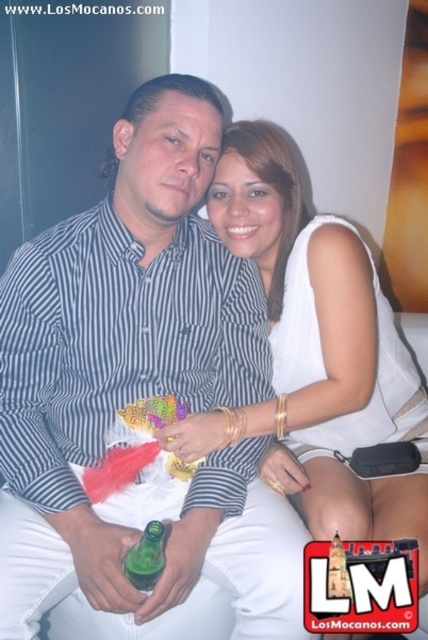
You are a photographer setting up a shoot in this scene. You need to place a small prop between the striped cotton shirt at center and the white satin dress at center. Based on their positions, where should you place the prop to ensure it is between them?

The striped cotton shirt at center is above the white satin dress at center, so you should place the prop below the striped cotton shirt at center and above the white satin dress at center to position it between them.

You are a photographer setting up a shoot. You need to place a new prop to the right of the striped cotton shirt at center. Where should you position it in relation to the green glass bottle at center?

Since the striped cotton shirt at center is to the left of the green glass bottle at center, placing the new prop to the right of the striped cotton shirt at center would position it between the shirt and the bottle. Therefore, the prop should be placed between the striped cotton shirt at center and the green glass bottle at center.

You are planning to place a white satin dress at center and a green glass bottle at center on a shelf. Which object should be placed first to ensure they both fit?

The white satin dress at center is wider than the green glass bottle at center, so place the wider white satin dress at center first to ensure both fit on the shelf.